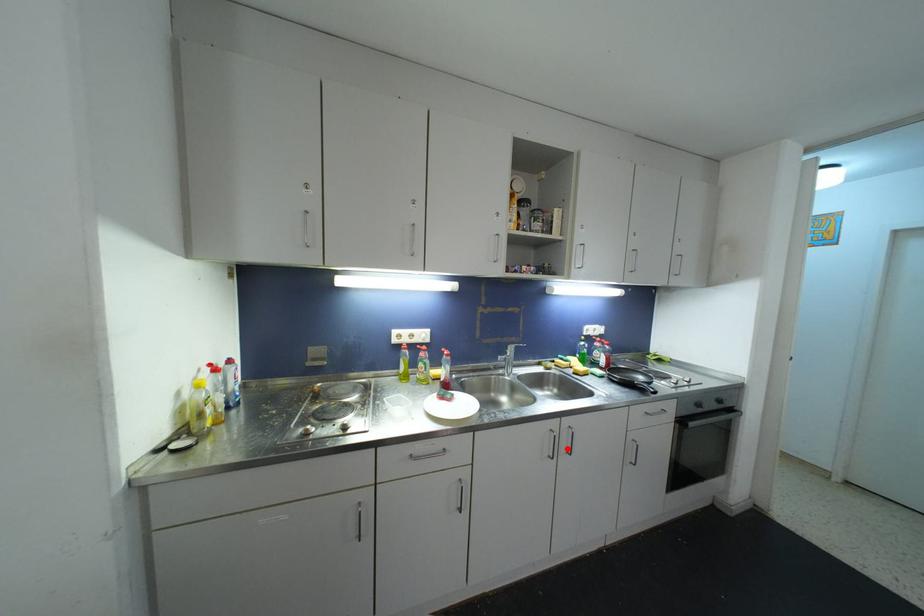
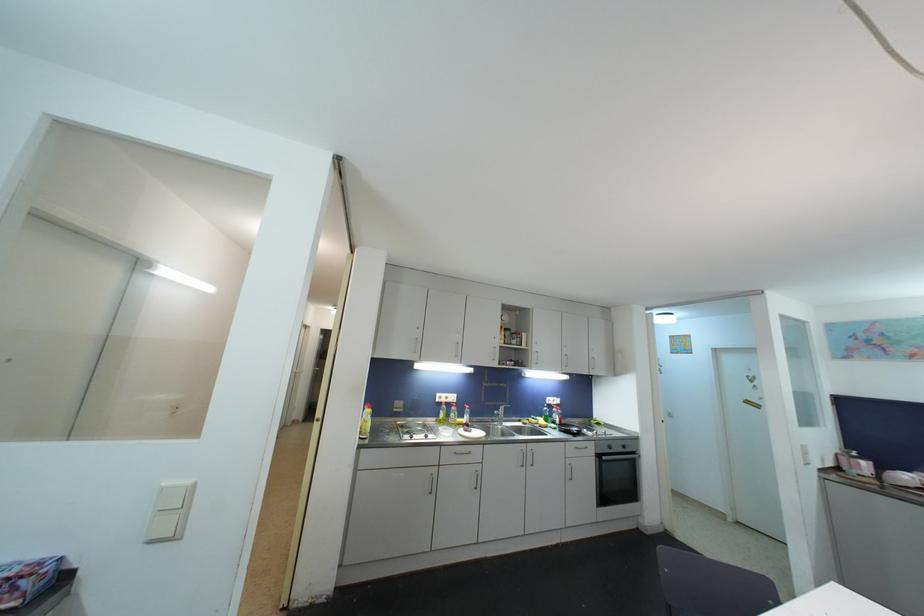
Find the pixel in the second image that matches the highlighted location in the first image.

(532, 464)